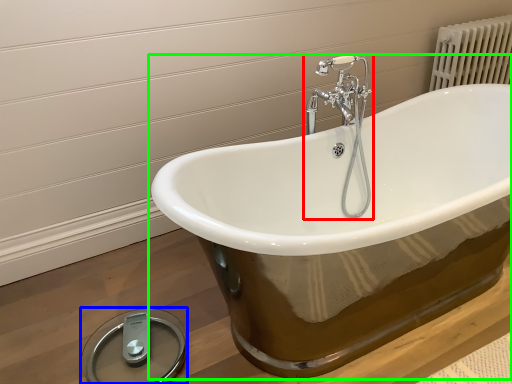
Question: Which is nearer to the tap (highlighted by a red box)? scale (highlighted by a blue box) or bathtub (highlighted by a green box).

Choices:
 (A) scale
 (B) bathtub

Answer: (B)